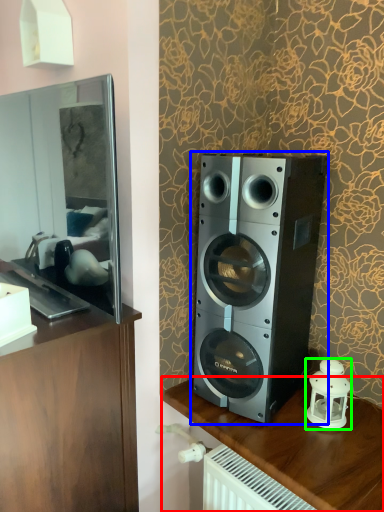
Question: Based on their relative distances, which object is farther from furniture (highlighted by a red box)? Choose from home appliance (highlighted by a blue box) and candle holder (highlighted by a green box).

Choices:
 (A) home appliance
 (B) candle holder

Answer: (A)